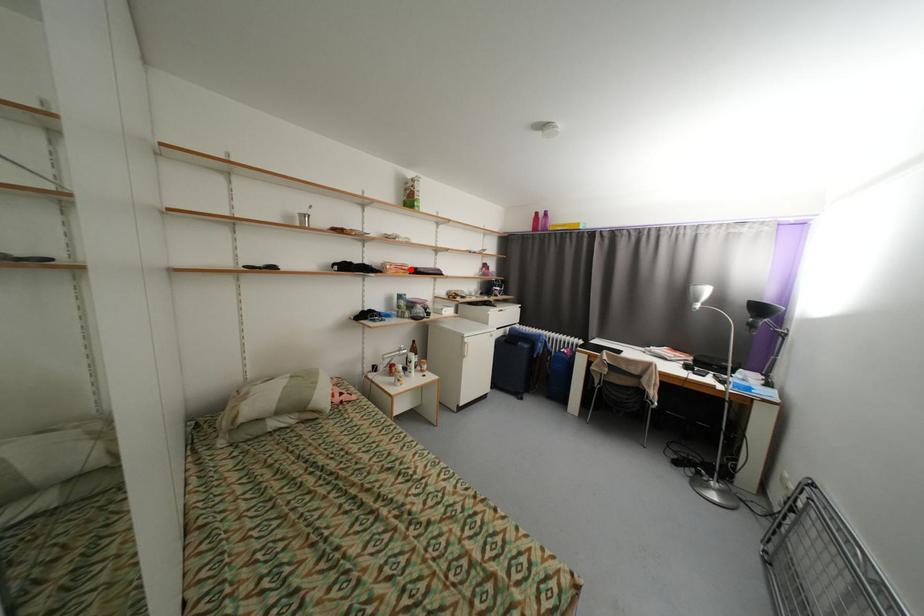
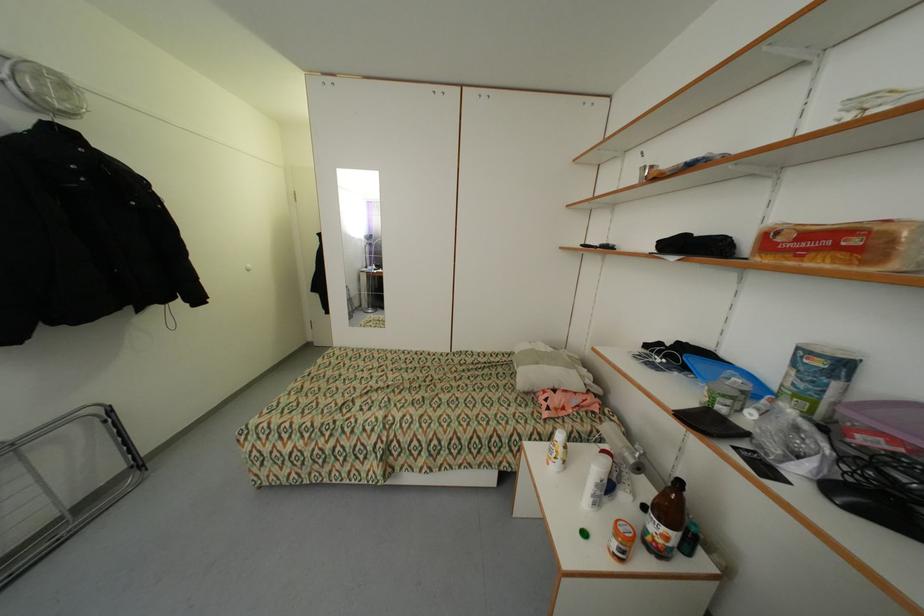
The point at the highlighted location is marked in the first image. Where is the corresponding point in the second image?

(860, 241)